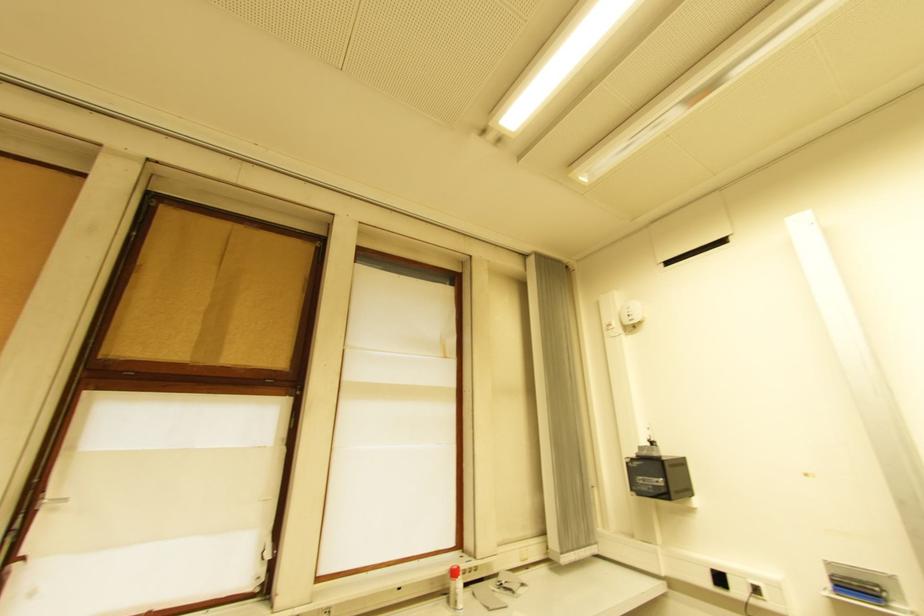
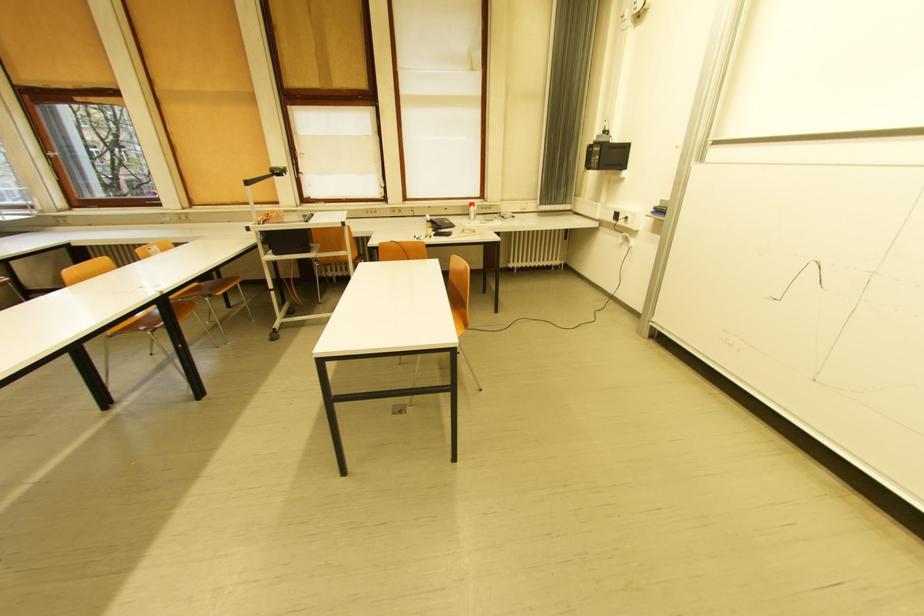
The point at [841,583] is marked in the first image. Where is the corresponding point in the second image?

(662, 209)